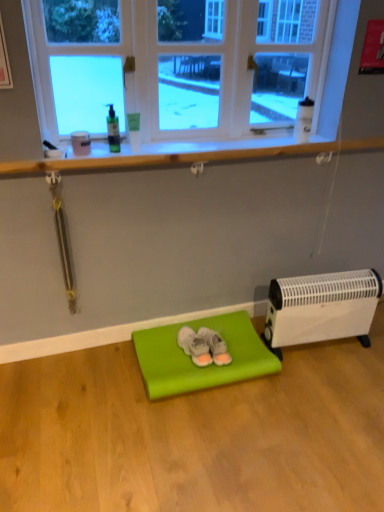
Image resolution: width=384 pixels, height=512 pixels. Find the location of `vacant area located to the right-hand side of white suede sneakers at center, which is the 1th footwear in right-to-left order`. vacant area located to the right-hand side of white suede sneakers at center, which is the 1th footwear in right-to-left order is located at coordinates (252, 348).